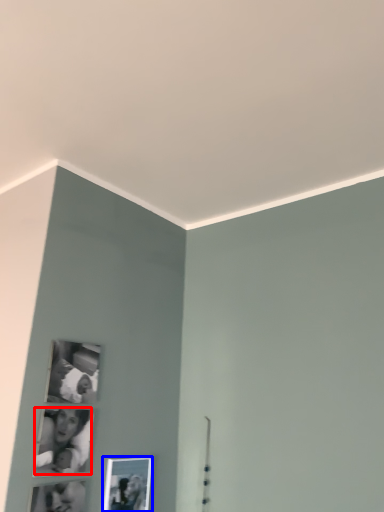
Question: Which of the following is the closest to the observer, couple (highlighted by a red box) or picture frame (highlighted by a blue box)?

Choices:
 (A) couple
 (B) picture frame

Answer: (A)